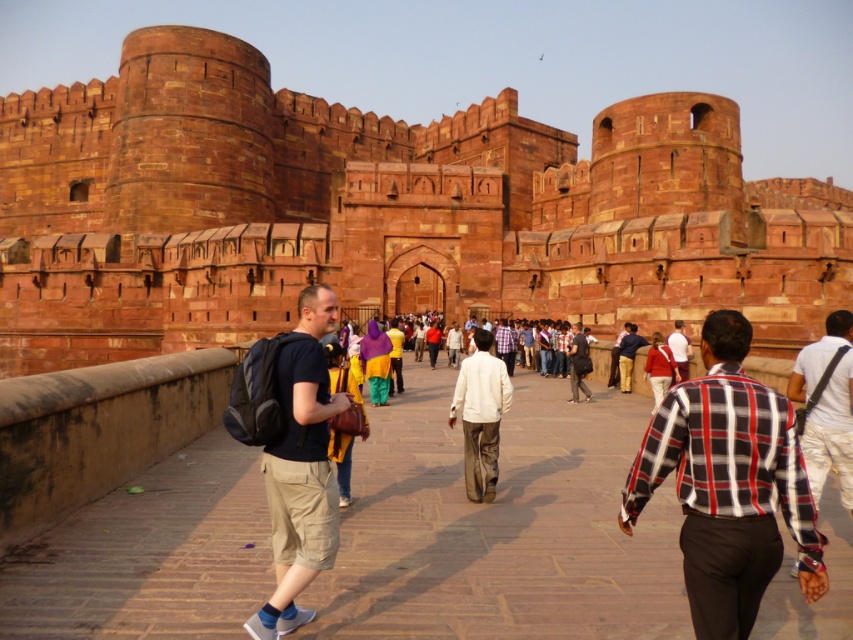
Can you confirm if plaid shirt at center is positioned above matte brown pants at center?

Correct, plaid shirt at center is located above matte brown pants at center.

Is plaid shirt at center shorter than matte brown pants at center?

In fact, plaid shirt at center may be taller than matte brown pants at center.

Is point (776, 392) behind point (634, 355)?

No, (776, 392) is closer to viewer.

This screenshot has width=853, height=640. Find the location of `plaid shirt at center`. plaid shirt at center is located at coordinates (728, 484).

Can you confirm if plaid shirt at center is thinner than plaid cotton shirt at center?

Incorrect, plaid shirt at center's width is not less than plaid cotton shirt at center's.

The width and height of the screenshot is (853, 640). What do you see at coordinates (728, 484) in the screenshot?
I see `plaid shirt at center` at bounding box center [728, 484].

Find the location of `plaid shirt at center`. plaid shirt at center is located at coordinates (728, 484).

Can you confirm if plaid cotton shirt at center is positioned below red plaid shirt at center?

Indeed, plaid cotton shirt at center is positioned under red plaid shirt at center.

Between plaid cotton shirt at center and red plaid shirt at center, which one has more height?

plaid cotton shirt at center

Who is more forward, (816, 355) or (664, 356)?

Point (816, 355)

Locate an element on the screen. This screenshot has width=853, height=640. plaid cotton shirt at center is located at coordinates (827, 406).